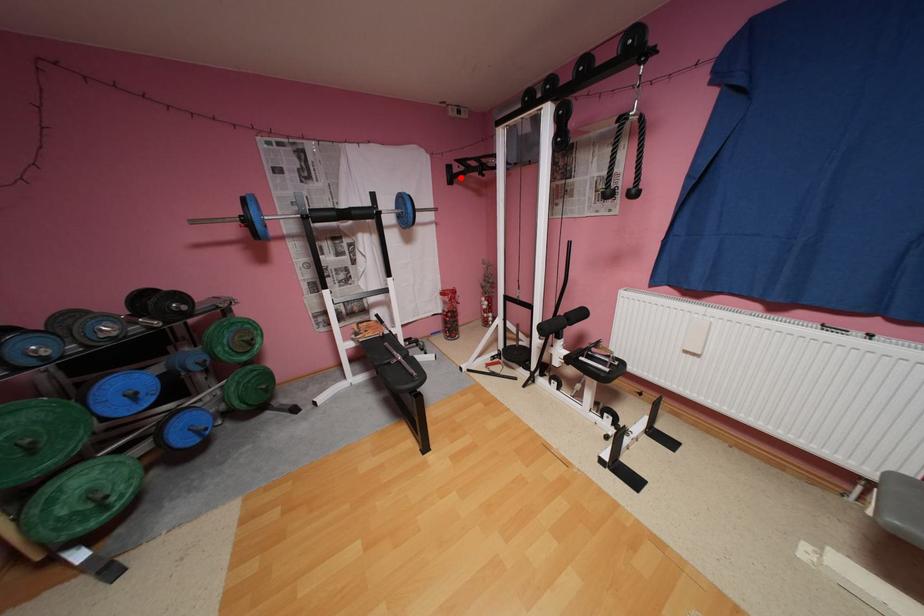
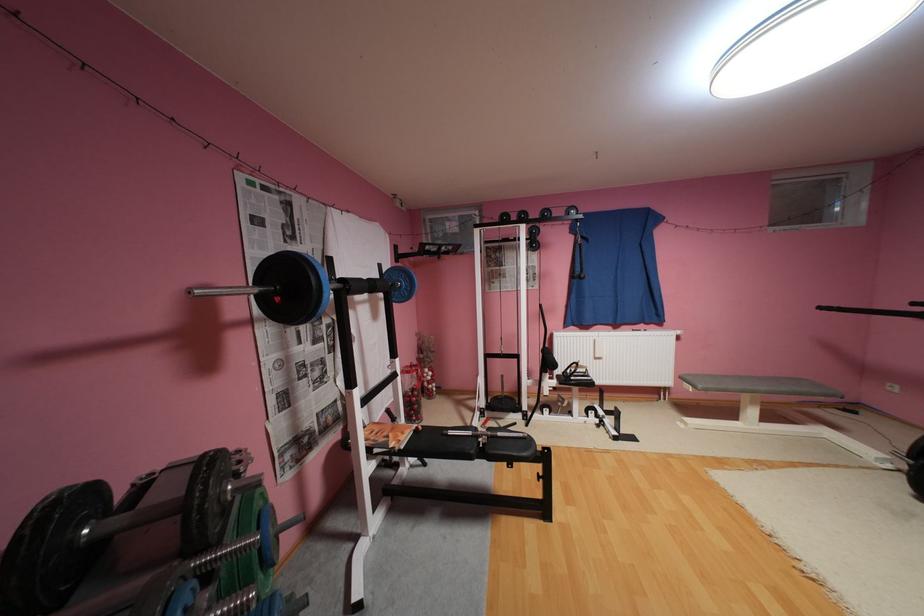
The point at the highlighted location is marked in the first image. Where is the corresponding point in the second image?

(407, 256)